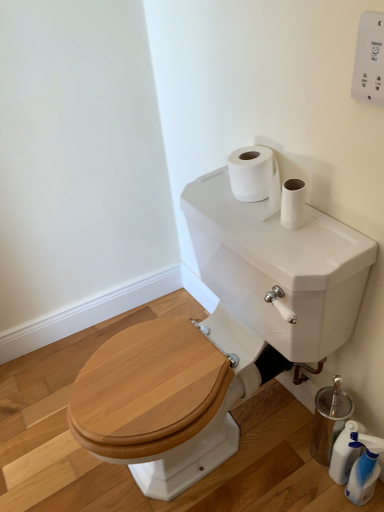
What is the approximate width of translucent plastic spray bottle at lower right, which is the 1th cleaning product in front-to-back order?

It is 4.20 inches.

This screenshot has height=512, width=384. In order to click on white glossy tank at upper center in this screenshot , I will do click(x=219, y=339).

Based on the photo, which object is closer to the camera, translucent plastic bottle at lower right, which ranks as the 2th cleaning product in front-to-back order, or white plastic remote control at upper right?

white plastic remote control at upper right.

The width and height of the screenshot is (384, 512). I want to click on the 1st cleaning product counting from the right side of the white plastic remote control at upper right, so click(x=345, y=452).

Is white plastic remote control at upper right at the back of translucent plastic bottle at lower right, which ranks as the 2th cleaning product in front-to-back order?

That's not correct — translucent plastic bottle at lower right, which ranks as the 2th cleaning product in front-to-back order, is not looking away from white plastic remote control at upper right.

Which of these two, translucent plastic bottle at lower right, which ranks as the 2th cleaning product in front-to-back order, or white plastic remote control at upper right, is bigger?

translucent plastic bottle at lower right, which ranks as the 2th cleaning product in front-to-back order.

From the picture: Is white glossy tank at upper center surrounded by white plastic remote control at upper right?

That's incorrect, white glossy tank at upper center is not inside white plastic remote control at upper right.

Is white plastic remote control at upper right facing towards white glossy tank at upper center?

No.

Is the depth of white plastic remote control at upper right greater than that of white glossy tank at upper center?

Yes.

Looking at the image, does white plastic remote control at upper right seem bigger or smaller compared to white glossy tank at upper center?

Clearly, white plastic remote control at upper right is smaller in size than white glossy tank at upper center.

Does white plastic remote control at upper right come in front of translucent plastic spray bottle at lower right, the second cleaning product from the back?

That is True.

Consider the image. Would you say white plastic remote control at upper right is to the left or to the right of translucent plastic spray bottle at lower right, the second cleaning product from the back, in the picture?

In the image, white plastic remote control at upper right appears on the left side of translucent plastic spray bottle at lower right, the second cleaning product from the back.

Is white glossy tank at upper center oriented towards translucent plastic bottle at lower right, marked as the 1th cleaning product in a back-to-front arrangement?

No, white glossy tank at upper center does not turn towards translucent plastic bottle at lower right, marked as the 1th cleaning product in a back-to-front arrangement.

Can you confirm if white glossy tank at upper center is bigger than translucent plastic bottle at lower right, marked as the 1th cleaning product in a back-to-front arrangement?

Yes.

From a real-world perspective, is white glossy tank at upper center over translucent plastic bottle at lower right, marked as the 1th cleaning product in a back-to-front arrangement?

Yes, from a real-world perspective, white glossy tank at upper center is on top of translucent plastic bottle at lower right, marked as the 1th cleaning product in a back-to-front arrangement.

Considering the sizes of objects white plastic remote control at upper right and translucent plastic bottle at lower right, marked as the 1th cleaning product in a back-to-front arrangement, in the image provided, who is bigger, white plastic remote control at upper right or translucent plastic bottle at lower right, marked as the 1th cleaning product in a back-to-front arrangement,?

With larger size is translucent plastic bottle at lower right, marked as the 1th cleaning product in a back-to-front arrangement.

From a real-world perspective, is white plastic remote control at upper right above or below translucent plastic bottle at lower right, marked as the 1th cleaning product in a back-to-front arrangement?

Clearly, from a real-world perspective, white plastic remote control at upper right is above translucent plastic bottle at lower right, marked as the 1th cleaning product in a back-to-front arrangement.

Does point (381, 69) come behind point (330, 472)?

No, (381, 69) is closer to viewer.

Is white plastic remote control at upper right turned away from translucent plastic bottle at lower right, which ranks as the 2th cleaning product in front-to-back order?

white plastic remote control at upper right does not have its back to translucent plastic bottle at lower right, which ranks as the 2th cleaning product in front-to-back order.

Is translucent plastic spray bottle at lower right, which is the 1th cleaning product in front-to-back order, shorter than white glossy tank at upper center?

Yes.

Could you tell me if translucent plastic spray bottle at lower right, the second cleaning product from the back, is turned towards white glossy tank at upper center?

Yes, translucent plastic spray bottle at lower right, the second cleaning product from the back, is turned towards white glossy tank at upper center.

From a real-world perspective, is translucent plastic spray bottle at lower right, which is the 1th cleaning product in front-to-back order, physically below white glossy tank at upper center?

Yes.

Considering their positions, is white glossy tank at upper center located in front of or behind translucent plastic spray bottle at lower right, which is the 1th cleaning product in front-to-back order?

white glossy tank at upper center is positioned closer to the viewer than translucent plastic spray bottle at lower right, which is the 1th cleaning product in front-to-back order.

Could you measure the distance between white glossy tank at upper center and translucent plastic spray bottle at lower right, which is the 1th cleaning product in front-to-back order?

The distance of white glossy tank at upper center from translucent plastic spray bottle at lower right, which is the 1th cleaning product in front-to-back order, is 18.80 inches.

In order to click on the 2nd cleaning product to the right of the white glossy tank at upper center, starting your count from the anchor in this screenshot , I will do `click(364, 468)`.

Considering the sizes of objects white glossy tank at upper center and translucent plastic spray bottle at lower right, the second cleaning product from the back, in the image provided, who is smaller, white glossy tank at upper center or translucent plastic spray bottle at lower right, the second cleaning product from the back,?

translucent plastic spray bottle at lower right, the second cleaning product from the back, is smaller.

Find the location of a particular element. This screenshot has width=384, height=512. electric outlet on the left of translucent plastic bottle at lower right, which ranks as the 2th cleaning product in front-to-back order is located at coordinates (369, 59).

The height and width of the screenshot is (512, 384). I want to click on electric outlet located above the white glossy tank at upper center (from a real-world perspective), so click(x=369, y=59).

Looking at the image, which one is located further to white glossy tank at upper center, translucent plastic bottle at lower right, marked as the 1th cleaning product in a back-to-front arrangement, or translucent plastic spray bottle at lower right, the second cleaning product from the back?

Based on the image, translucent plastic spray bottle at lower right, the second cleaning product from the back, appears to be further to white glossy tank at upper center.

When comparing their distances from white plastic remote control at upper right, does translucent plastic bottle at lower right, marked as the 1th cleaning product in a back-to-front arrangement, or translucent plastic spray bottle at lower right, which is the 1th cleaning product in front-to-back order, seem further?

translucent plastic bottle at lower right, marked as the 1th cleaning product in a back-to-front arrangement, is further to white plastic remote control at upper right.

Based on their spatial positions, is white plastic remote control at upper right or translucent plastic spray bottle at lower right, the second cleaning product from the back, closer to white glossy tank at upper center?

The object closer to white glossy tank at upper center is translucent plastic spray bottle at lower right, the second cleaning product from the back.

From the image, which object appears to be nearer to translucent plastic bottle at lower right, marked as the 1th cleaning product in a back-to-front arrangement, white glossy tank at upper center or translucent plastic spray bottle at lower right, the second cleaning product from the back?

Based on the image, translucent plastic spray bottle at lower right, the second cleaning product from the back, appears to be nearer to translucent plastic bottle at lower right, marked as the 1th cleaning product in a back-to-front arrangement.

Based on their spatial positions, is white glossy tank at upper center or white plastic remote control at upper right further from translucent plastic spray bottle at lower right, which is the 1th cleaning product in front-to-back order?

Based on the image, white plastic remote control at upper right appears to be further to translucent plastic spray bottle at lower right, which is the 1th cleaning product in front-to-back order.

Consider the image. Looking at the image, which one is located closer to white plastic remote control at upper right, white glossy tank at upper center or translucent plastic bottle at lower right, marked as the 1th cleaning product in a back-to-front arrangement?

The object closer to white plastic remote control at upper right is white glossy tank at upper center.

From the picture: Looking at the image, which one is located further to translucent plastic spray bottle at lower right, which is the 1th cleaning product in front-to-back order, translucent plastic bottle at lower right, marked as the 1th cleaning product in a back-to-front arrangement, or white plastic remote control at upper right?

white plastic remote control at upper right.

Estimate the real-world distances between objects in this image. Which object is further from translucent plastic bottle at lower right, marked as the 1th cleaning product in a back-to-front arrangement, translucent plastic spray bottle at lower right, the second cleaning product from the back, or white glossy tank at upper center?

The object further to translucent plastic bottle at lower right, marked as the 1th cleaning product in a back-to-front arrangement, is white glossy tank at upper center.

At what (x,y) coordinates should I click in order to perform the action: click on sink between white plastic remote control at upper right and translucent plastic spray bottle at lower right, which is the 1th cleaning product in front-to-back order, in the vertical direction. Please return your answer as a coordinate pair (x, y). Image resolution: width=384 pixels, height=512 pixels. Looking at the image, I should click on (219, 339).

Where is `cleaning product between white plastic remote control at upper right and translucent plastic spray bottle at lower right, which is the 1th cleaning product in front-to-back order, vertically`? The width and height of the screenshot is (384, 512). cleaning product between white plastic remote control at upper right and translucent plastic spray bottle at lower right, which is the 1th cleaning product in front-to-back order, vertically is located at coordinates (345, 452).

Where is `cleaning product located between white glossy tank at upper center and translucent plastic spray bottle at lower right, the second cleaning product from the back, in the left-right direction`? The image size is (384, 512). cleaning product located between white glossy tank at upper center and translucent plastic spray bottle at lower right, the second cleaning product from the back, in the left-right direction is located at coordinates (345, 452).

The image size is (384, 512). Find the location of `sink that lies between white plastic remote control at upper right and translucent plastic bottle at lower right, marked as the 1th cleaning product in a back-to-front arrangement, from top to bottom`. sink that lies between white plastic remote control at upper right and translucent plastic bottle at lower right, marked as the 1th cleaning product in a back-to-front arrangement, from top to bottom is located at coordinates (219, 339).